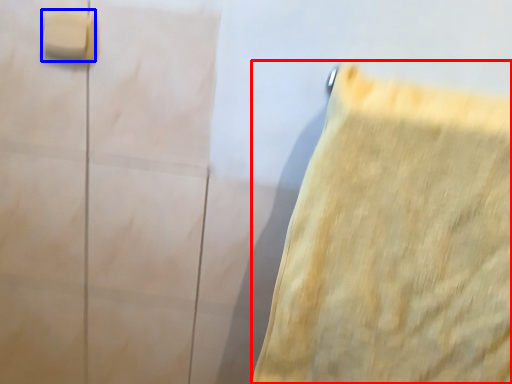
Question: Which point is closer to the camera, towel (highlighted by a red box) or light switch (highlighted by a blue box)?

Choices:
 (A) towel
 (B) light switch

Answer: (A)